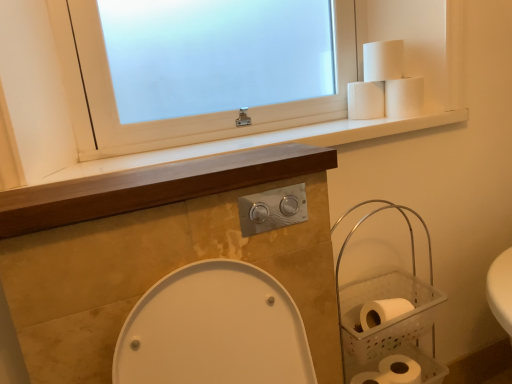
Locate an element on the screen. free location above wooden at center (from a real-world perspective) is located at coordinates coord(183,173).